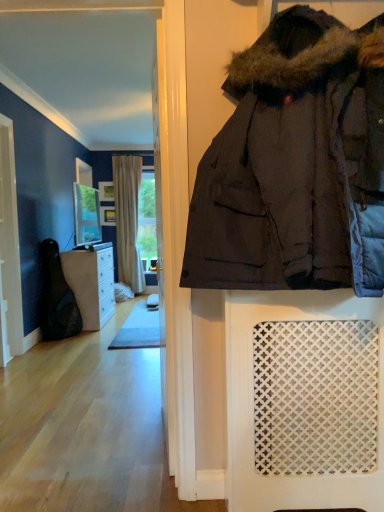
Question: Can you confirm if white wood screen door at left is thinner than wooden frame at center, which appears as the second picture frame when viewed from the top?

Choices:
 (A) no
 (B) yes

Answer: (A)

Question: Is white wood screen door at left positioned behind wooden frame at center, which appears as the second picture frame when viewed from the top?

Choices:
 (A) yes
 (B) no

Answer: (B)

Question: From a real-world perspective, is white wood screen door at left on top of wooden frame at center, which appears as the second picture frame when viewed from the top?

Choices:
 (A) yes
 (B) no

Answer: (B)

Question: Is white wood screen door at left smaller than wooden frame at center, arranged as the 1th picture frame when ordered from the bottom?

Choices:
 (A) yes
 (B) no

Answer: (B)

Question: Is white wood screen door at left bigger than wooden frame at center, arranged as the 1th picture frame when ordered from the bottom?

Choices:
 (A) yes
 (B) no

Answer: (A)

Question: From a real-world perspective, is white wood screen door at left physically located above or below beige textured curtain at center?

Choices:
 (A) above
 (B) below

Answer: (B)

Question: Is point (1, 148) closer or farther from the camera than point (137, 163)?

Choices:
 (A) farther
 (B) closer

Answer: (B)

Question: Considering the positions of white wood screen door at left and beige textured curtain at center in the image, is white wood screen door at left wider or thinner than beige textured curtain at center?

Choices:
 (A) thin
 (B) wide

Answer: (A)

Question: Considering their positions, is white wood screen door at left located in front of or behind beige textured curtain at center?

Choices:
 (A) front
 (B) behind

Answer: (A)

Question: In terms of width, does white wood screen door at left look wider or thinner when compared to brown wood cabinet at left?

Choices:
 (A) thin
 (B) wide

Answer: (A)

Question: Is white wood screen door at left taller or shorter than brown wood cabinet at left?

Choices:
 (A) short
 (B) tall

Answer: (B)

Question: Is white wood screen door at left bigger or smaller than brown wood cabinet at left?

Choices:
 (A) big
 (B) small

Answer: (B)

Question: From the image's perspective, is white wood screen door at left located above or below brown wood cabinet at left?

Choices:
 (A) below
 (B) above

Answer: (B)

Question: Which is correct: matte glass mirror at upper center is inside wooden frame at center, arranged as the 1th picture frame when ordered from the bottom, or outside of it?

Choices:
 (A) inside
 (B) outside

Answer: (B)

Question: From the image's perspective, is matte glass mirror at upper center positioned above or below wooden frame at center, arranged as the 1th picture frame when ordered from the bottom?

Choices:
 (A) below
 (B) above

Answer: (A)